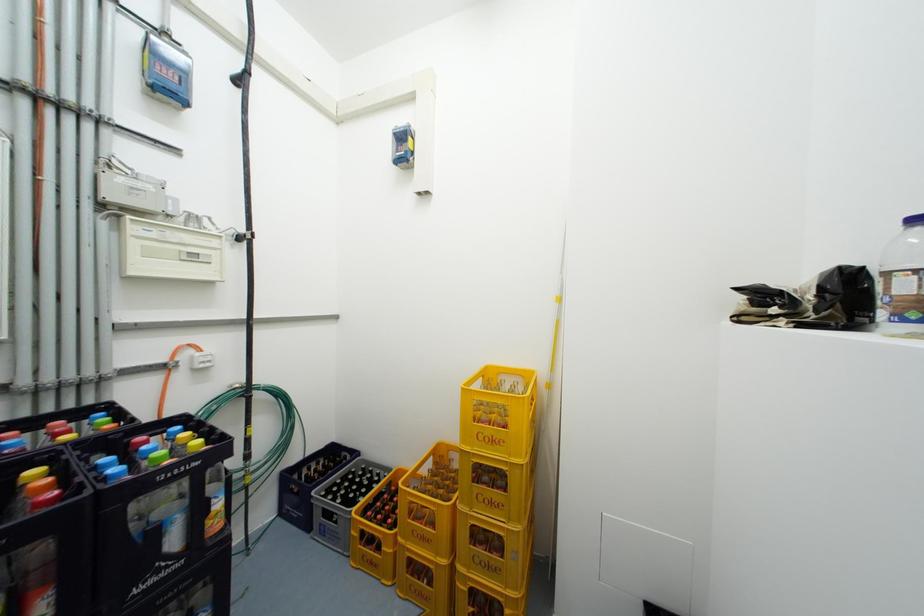
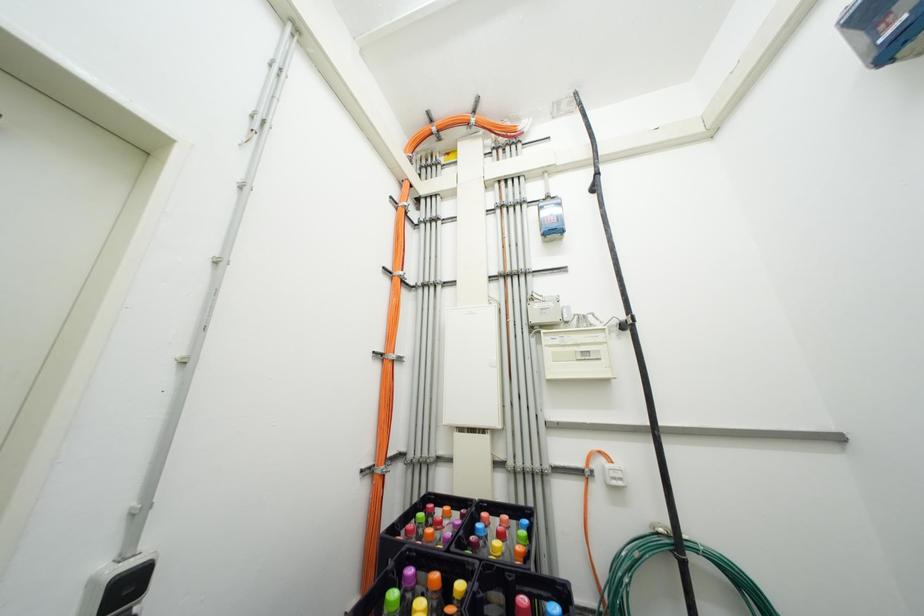
The first image is from the beginning of the video and the second image is from the end. How did the camera likely rotate when shooting the video?

The camera rotated toward left-up.